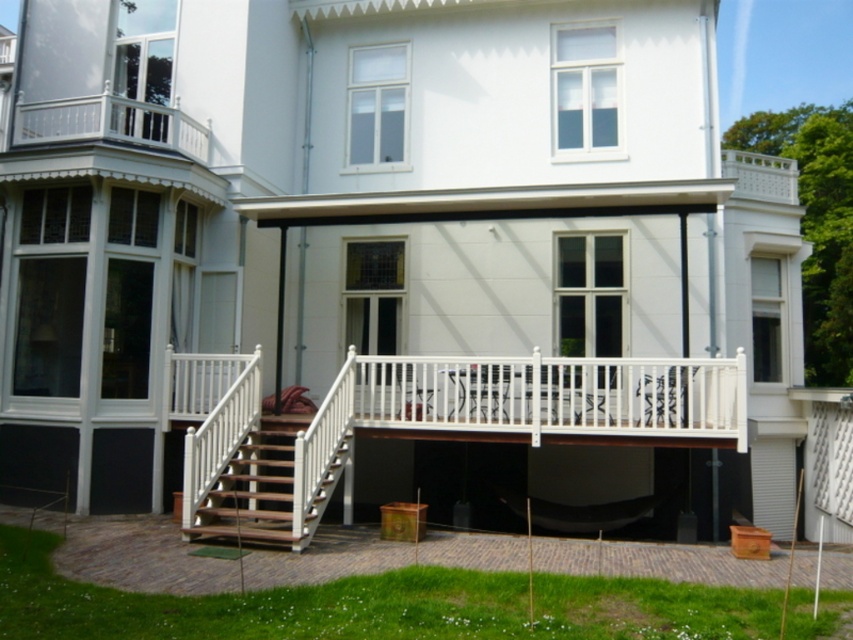
Question: Among these points, which one is nearest to the camera?

Choices:
 (A) (419, 545)
 (B) (216, 524)
 (C) (730, 401)

Answer: (A)

Question: Considering the relative positions of brown wooden deck at lower center and wooden stairs at center in the image provided, where is brown wooden deck at lower center located with respect to wooden stairs at center?

Choices:
 (A) right
 (B) left

Answer: (A)

Question: Which point is farther to the camera?

Choices:
 (A) click(299, 531)
 (B) click(511, 436)

Answer: (B)

Question: Does white wooden porch at center appear under wooden stairs at center?

Choices:
 (A) yes
 (B) no

Answer: (B)

Question: Which point appears closest to the camera in this image?

Choices:
 (A) (563, 563)
 (B) (352, 435)
 (C) (728, 433)

Answer: (A)

Question: Does white wooden porch at center have a greater width compared to wooden stairs at center?

Choices:
 (A) yes
 (B) no

Answer: (A)